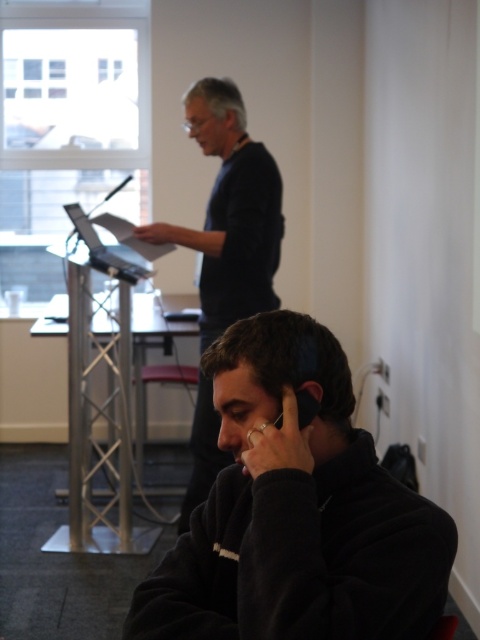
You are organizing a meeting in this room and need to place a 15 cm tall decorative vase between the black matte phone at lower center and the dark blue sweater at center. Can the vase fit vertically between them based on their current positions?

The black matte phone at lower center is positioned under the dark blue sweater at center, so there is sufficient vertical space for a 15 cm tall vase to fit between them.

You are a security camera in the conference room. You need to determine if the black matte phone at lower center is within the restricted area marked from coordinates 0.7 to 0.9 on the x and y axes. Is it inside the restricted area?

The black matte phone at lower center is at point (296, 512). The restricted area spans from 0.7 to 0.9 on both axes. Since both coordinates fall within the range, the phone is inside the restricted area.